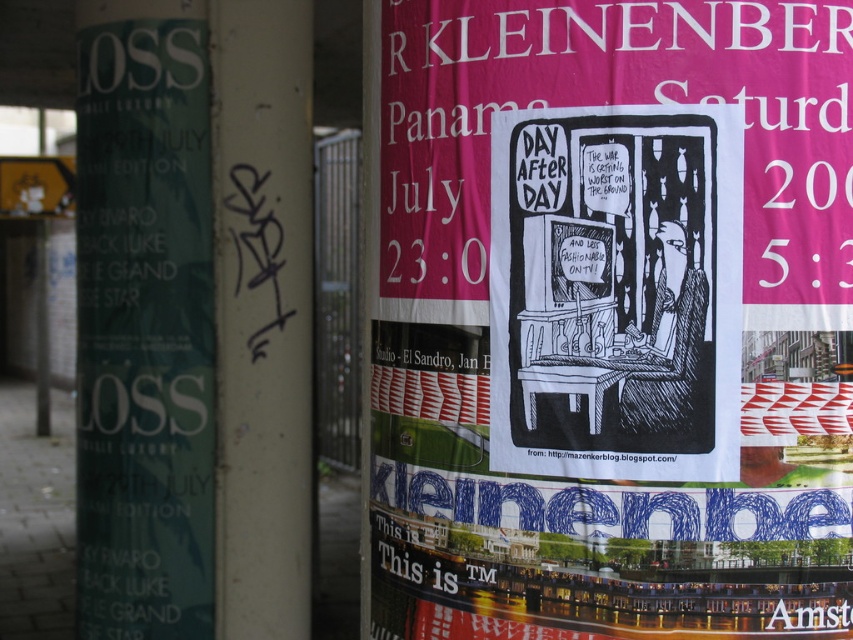
Is black paper poster at center taller than white painted pillar at center?

Incorrect, black paper poster at center's height is not larger of white painted pillar at center's.

The height and width of the screenshot is (640, 853). I want to click on black paper poster at center, so click(611, 320).

Is point (405, 240) positioned after point (289, 100)?

No, (405, 240) is in front of (289, 100).

The image size is (853, 640). I want to click on black paper poster at center, so click(611, 320).